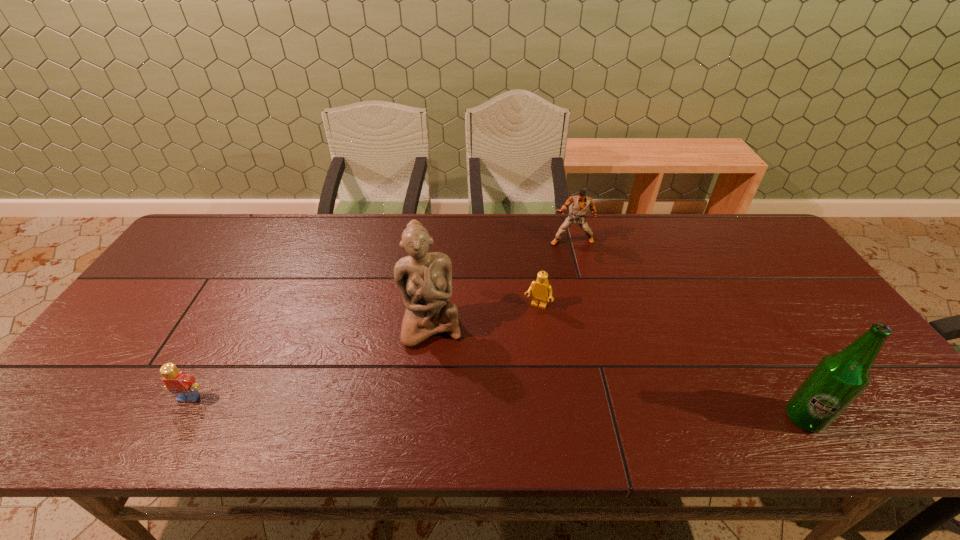
The image size is (960, 540). I want to click on free space that is in between the left Lego and the second object from right to left, so [x=380, y=319].

Where is `free spot between the nearer Lego and the second object from left to right`? free spot between the nearer Lego and the second object from left to right is located at coordinates (310, 361).

The height and width of the screenshot is (540, 960). Identify the location of empty space that is in between the farther Lego and the leftmost object. [x=364, y=352].

I want to click on free area in between the puncher and the fourth object from right to left, so click(x=501, y=283).

At what (x,y) coordinates should I click in order to perform the action: click on vacant region between the rightmost object and the nearer Lego. Please return your answer as a coordinate pair (x, y). The height and width of the screenshot is (540, 960). Looking at the image, I should click on (496, 408).

You are a GUI agent. You are given a task and a screenshot of the screen. Output one action in this format:
    pyautogui.click(x=<x>, y=<y>)
    Task: Click on the unoccupied position between the farther Lego and the leftmost object
    This screenshot has height=540, width=960.
    Given the screenshot: What is the action you would take?
    pyautogui.click(x=364, y=352)

You are a GUI agent. You are given a task and a screenshot of the screen. Output one action in this format:
    pyautogui.click(x=<x>, y=<y>)
    Task: Click on the object that stands as the second closest to the right Lego
    
    Given the screenshot: What is the action you would take?
    tap(580, 205)

Locate an element on the screen. This screenshot has width=960, height=540. object that is the nearest to the second object from left to right is located at coordinates (541, 288).